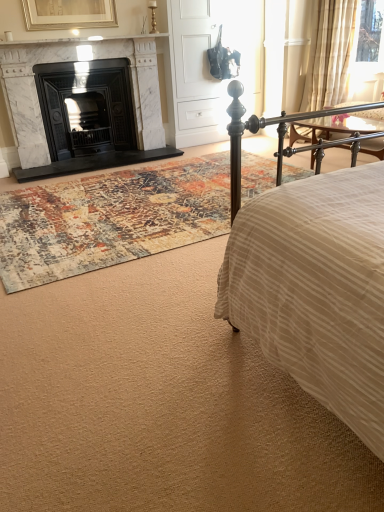
What do you see at coordinates (153, 16) in the screenshot? Image resolution: width=384 pixels, height=512 pixels. I see `gold metallic table lamp at upper center` at bounding box center [153, 16].

What are the coordinates of `white marble fireplace at left, positioned as the second fireplace in left-to-right order` in the screenshot? It's located at (29, 97).

At what (x,y) coordinates should I click in order to perform the action: click on sheer beige fabric at upper right. Please return your answer as a coordinate pair (x, y). The image size is (384, 512). Looking at the image, I should click on (329, 53).

Locate an element on the screen. Image resolution: width=384 pixels, height=512 pixels. the 1st fireplace counting from the left of the multicolored rug at center is located at coordinates (29, 97).

Is white marble fireplace at left, positioned as the second fireplace in left-to-right order, facing away from multicolored rug at center?

white marble fireplace at left, positioned as the second fireplace in left-to-right order, does not have its back to multicolored rug at center.

How many degrees apart are the facing directions of white marble fireplace at left, which ranks as the 1th fireplace in right-to-left order, and multicolored rug at center?

The angular difference between white marble fireplace at left, which ranks as the 1th fireplace in right-to-left order, and multicolored rug at center is 0.706 degrees.

How much distance is there between white marble fireplace at left, which ranks as the 1th fireplace in right-to-left order, and multicolored rug at center?

1.35 meters.

Looking at this image, considering the sizes of objects black marble fireplace at left, the 2th fireplace when ordered from right to left, and gold metallic table lamp at upper center in the image provided, who is taller, black marble fireplace at left, the 2th fireplace when ordered from right to left, or gold metallic table lamp at upper center?

black marble fireplace at left, the 2th fireplace when ordered from right to left, is taller.

Could you measure the distance between black marble fireplace at left, placed as the 1th fireplace when sorted from left to right, and gold metallic table lamp at upper center?

3.50 feet.

Would you say gold metallic table lamp at upper center is part of black marble fireplace at left, placed as the 1th fireplace when sorted from left to right,'s contents?

That's incorrect, gold metallic table lamp at upper center is not inside black marble fireplace at left, placed as the 1th fireplace when sorted from left to right.

Relative to gold metallic table lamp at upper center, is black marble fireplace at left, the 2th fireplace when ordered from right to left, in front or behind?

In the image, black marble fireplace at left, the 2th fireplace when ordered from right to left, appears in front of gold metallic table lamp at upper center.

Is gold metallic table lamp at upper center located within sheer beige fabric at upper right?

No.

Which object is more forward, sheer beige fabric at upper right or gold metallic table lamp at upper center?

sheer beige fabric at upper right is in front.

Is sheer beige fabric at upper right facing away from gold metallic table lamp at upper center?

No, sheer beige fabric at upper right is not facing the opposite direction of gold metallic table lamp at upper center.

Is point (151, 4) farther from camera compared to point (196, 94)?

No, (151, 4) is closer to viewer.

Measure the distance from gold metallic table lamp at upper center to white matte armoire at center.

A distance of 27.23 inches exists between gold metallic table lamp at upper center and white matte armoire at center.

Which of these two, gold metallic table lamp at upper center or white matte armoire at center, is wider?

Wider between the two is white matte armoire at center.

Which object is positioned more to the right, gold metallic table lamp at upper center or white matte armoire at center?

white matte armoire at center.

Which of these two, multicolored rug at center or white matte armoire at center, is thinner?

With smaller width is white matte armoire at center.

In terms of size, does multicolored rug at center appear bigger or smaller than white matte armoire at center?

In the image, multicolored rug at center appears to be smaller than white matte armoire at center.

Is point (166, 207) positioned behind point (176, 25)?

No, (166, 207) is in front of (176, 25).

Is multicolored rug at center in front of white matte armoire at center?

Yes, it is.

How much distance is there between gold metallic table lamp at upper center and white marble fireplace at left, which ranks as the 1th fireplace in right-to-left order?

The distance of gold metallic table lamp at upper center from white marble fireplace at left, which ranks as the 1th fireplace in right-to-left order, is 1.01 meters.

From a real-world perspective, is gold metallic table lamp at upper center positioned above or below white marble fireplace at left, which ranks as the 1th fireplace in right-to-left order?

From a real-world perspective, gold metallic table lamp at upper center is physically above white marble fireplace at left, which ranks as the 1th fireplace in right-to-left order.

From the image's perspective, relative to white marble fireplace at left, which ranks as the 1th fireplace in right-to-left order, is gold metallic table lamp at upper center above or below?

Clearly, from the image's perspective, gold metallic table lamp at upper center is above white marble fireplace at left, which ranks as the 1th fireplace in right-to-left order.

Based on the photo, could you tell me if gold metallic table lamp at upper center is turned towards white marble fireplace at left, positioned as the second fireplace in left-to-right order?

No.

Can you tell me how much white marble fireplace at left, which ranks as the 1th fireplace in right-to-left order, and white matte armoire at center differ in facing direction?

0.684 degrees.

Considering the relative sizes of white marble fireplace at left, positioned as the second fireplace in left-to-right order, and white matte armoire at center in the image provided, is white marble fireplace at left, positioned as the second fireplace in left-to-right order, shorter than white matte armoire at center?

Yes.

Which object is closer to the camera, white marble fireplace at left, which ranks as the 1th fireplace in right-to-left order, or white matte armoire at center?

white marble fireplace at left, which ranks as the 1th fireplace in right-to-left order, is closer to the camera.

Which point is more distant from viewer, (20, 144) or (207, 108)?

The point (207, 108) is more distant.

Identify the location of mat on the right side of white marble fireplace at left, which ranks as the 1th fireplace in right-to-left order. This screenshot has width=384, height=512. (110, 219).

This screenshot has height=512, width=384. I want to click on table lamp above the black marble fireplace at left, the 2th fireplace when ordered from right to left (from a real-world perspective), so click(x=153, y=16).

Which object lies nearer to the anchor point black marble fireplace at left, the 2th fireplace when ordered from right to left, multicolored rug at center or white matte armoire at center?

white matte armoire at center is closer to black marble fireplace at left, the 2th fireplace when ordered from right to left.

Looking at the image, which one is located further to multicolored rug at center, sheer beige fabric at upper right or gold metallic table lamp at upper center?

Among the two, sheer beige fabric at upper right is located further to multicolored rug at center.

Which object lies further to the anchor point multicolored rug at center, sheer beige fabric at upper right or white matte armoire at center?

sheer beige fabric at upper right.

Which object lies nearer to the anchor point black marble fireplace at left, the 2th fireplace when ordered from right to left, white marble fireplace at left, which ranks as the 1th fireplace in right-to-left order, or sheer beige fabric at upper right?

white marble fireplace at left, which ranks as the 1th fireplace in right-to-left order, is closer to black marble fireplace at left, the 2th fireplace when ordered from right to left.

Estimate the real-world distances between objects in this image. Which object is further from sheer beige fabric at upper right, black marble fireplace at left, the 2th fireplace when ordered from right to left, or gold metallic table lamp at upper center?

black marble fireplace at left, the 2th fireplace when ordered from right to left, is positioned further to the anchor sheer beige fabric at upper right.

When comparing their distances from multicolored rug at center, does white matte armoire at center or gold metallic table lamp at upper center seem closer?

Based on the image, white matte armoire at center appears to be nearer to multicolored rug at center.

From the picture: When comparing their distances from white marble fireplace at left, positioned as the second fireplace in left-to-right order, does white matte armoire at center or sheer beige fabric at upper right seem closer?

white matte armoire at center.

From the image, which object appears to be nearer to sheer beige fabric at upper right, multicolored rug at center or white matte armoire at center?

white matte armoire at center is closer to sheer beige fabric at upper right.

Find the location of `fireplace between black marble fireplace at left, the 2th fireplace when ordered from right to left, and sheer beige fabric at upper right`. fireplace between black marble fireplace at left, the 2th fireplace when ordered from right to left, and sheer beige fabric at upper right is located at coordinates (29, 97).

You are a GUI agent. You are given a task and a screenshot of the screen. Output one action in this format:
    pyautogui.click(x=<x>, y=<y>)
    Task: Click on the armoire located between gold metallic table lamp at upper center and sheer beige fabric at upper right in the left-right direction
    The width and height of the screenshot is (384, 512).
    Given the screenshot: What is the action you would take?
    pyautogui.click(x=196, y=73)

Where is `fireplace between multicolored rug at center and black marble fireplace at left, the 2th fireplace when ordered from right to left, in the front-back direction`? The width and height of the screenshot is (384, 512). fireplace between multicolored rug at center and black marble fireplace at left, the 2th fireplace when ordered from right to left, in the front-back direction is located at coordinates (29, 97).

The height and width of the screenshot is (512, 384). Identify the location of armoire between black marble fireplace at left, placed as the 1th fireplace when sorted from left to right, and sheer beige fabric at upper right from left to right. (196, 73).